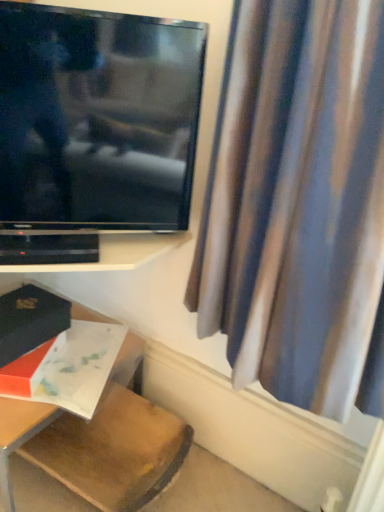
Question: Can you confirm if matte white book at lower left, which ranks as the 1th book in bottom-to-top order, is thinner than flat screen tv at upper left?

Choices:
 (A) no
 (B) yes

Answer: (A)

Question: Are matte white book at lower left, which is counted as the 2th book, starting from the top, and flat screen tv at upper left located far from each other?

Choices:
 (A) yes
 (B) no

Answer: (B)

Question: From the image's perspective, does matte white book at lower left, which ranks as the 1th book in bottom-to-top order, appear higher than flat screen tv at upper left?

Choices:
 (A) yes
 (B) no

Answer: (B)

Question: Can you confirm if matte white book at lower left, which ranks as the 1th book in bottom-to-top order, is wider than flat screen tv at upper left?

Choices:
 (A) yes
 (B) no

Answer: (A)

Question: From a real-world perspective, is matte white book at lower left, which ranks as the 1th book in bottom-to-top order, located beneath flat screen tv at upper left?

Choices:
 (A) yes
 (B) no

Answer: (A)

Question: Choose the correct answer: Is matte black book at lower left, which is counted as the first book, starting from the top, inside flat screen tv at upper left or outside it?

Choices:
 (A) outside
 (B) inside

Answer: (A)

Question: From the image's perspective, is matte black book at lower left, which is counted as the first book, starting from the top, located above or below flat screen tv at upper left?

Choices:
 (A) below
 (B) above

Answer: (A)

Question: Based on their positions, is matte black book at lower left, arranged as the second book when ordered from the bottom, located to the left or right of flat screen tv at upper left?

Choices:
 (A) left
 (B) right

Answer: (A)

Question: Is matte black book at lower left, which is counted as the first book, starting from the top, bigger or smaller than flat screen tv at upper left?

Choices:
 (A) big
 (B) small

Answer: (B)

Question: Is flat screen tv at upper left wider or thinner than matte black book at lower left, which is counted as the first book, starting from the top?

Choices:
 (A) thin
 (B) wide

Answer: (A)

Question: Based on their sizes in the image, would you say flat screen tv at upper left is bigger or smaller than matte black book at lower left, which is counted as the first book, starting from the top?

Choices:
 (A) small
 (B) big

Answer: (B)

Question: From the image's perspective, is flat screen tv at upper left located above or below matte black book at lower left, which is counted as the first book, starting from the top?

Choices:
 (A) above
 (B) below

Answer: (A)

Question: In the image, is flat screen tv at upper left positioned in front of or behind matte black book at lower left, arranged as the second book when ordered from the bottom?

Choices:
 (A) front
 (B) behind

Answer: (A)

Question: Considering the positions of wooden table at lower left and matte white book at lower left, which ranks as the 1th book in bottom-to-top order, in the image, is wooden table at lower left bigger or smaller than matte white book at lower left, which ranks as the 1th book in bottom-to-top order,?

Choices:
 (A) big
 (B) small

Answer: (A)

Question: In the image, is wooden table at lower left on the left side or the right side of matte white book at lower left, which is counted as the 2th book, starting from the top?

Choices:
 (A) right
 (B) left

Answer: (B)